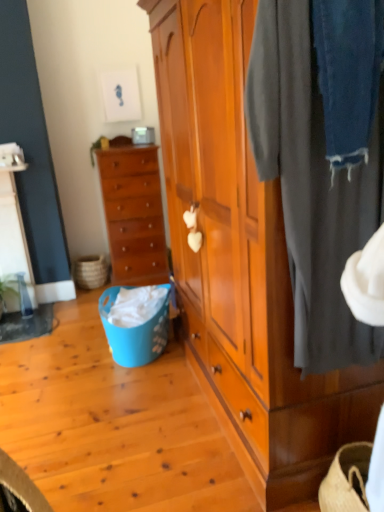
Question: Based on their sizes in the image, would you say wooden chest of drawers at center left is bigger or smaller than dark gray fabric at right?

Choices:
 (A) small
 (B) big

Answer: (B)

Question: Is wooden chest of drawers at center left situated inside dark gray fabric at right or outside?

Choices:
 (A) inside
 (B) outside

Answer: (B)

Question: Which object is the farthest from the blue plastic picnic basket at lower left, the second picnic basket from the back?

Choices:
 (A) wooden chest of drawers at center left
 (B) dark gray fabric at right
 (C) natural woven picnic basket at lower left, the first picnic basket from the left
 (D) wooden wardrobe at center

Answer: (B)

Question: Based on their relative distances, which object is farther from the wooden wardrobe at center?

Choices:
 (A) dark gray fabric at right
 (B) natural woven picnic basket at lower left, which is counted as the second picnic basket, starting from the right
 (C) blue plastic picnic basket at lower left, which appears as the first picnic basket when viewed from the right
 (D) wooden chest of drawers at center left

Answer: (B)